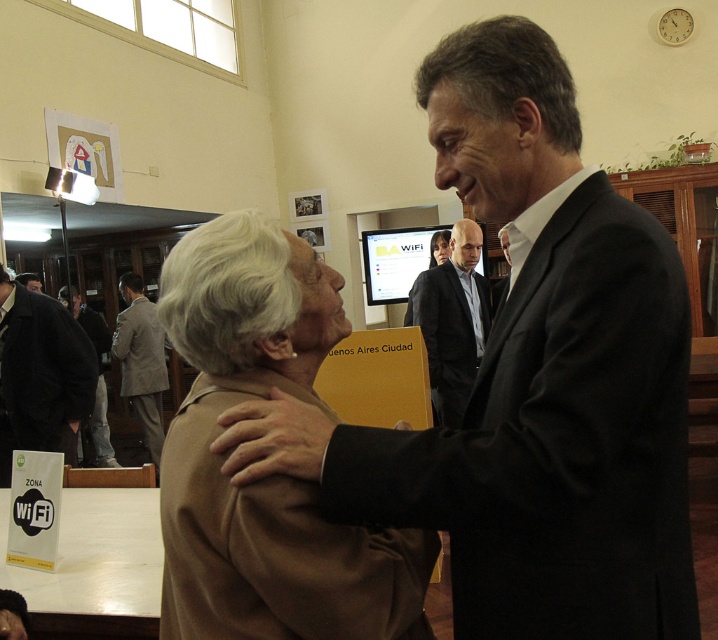
Between point (378, 579) and point (432, 365), which one is positioned behind?

Positioned behind is point (432, 365).

Is brown woolen coat at center closer to the viewer compared to dark suit jacket at center?

Yes.

Measure the distance between brown woolen coat at center and camera.

The distance of brown woolen coat at center from camera is 35.99 inches.

Where is `brown woolen coat at center`? brown woolen coat at center is located at coordinates (274, 476).

Is black leather jacket at left below dark suit jacket at center?

Indeed, black leather jacket at left is positioned under dark suit jacket at center.

Between black leather jacket at left and dark suit jacket at center, which one has more height?

dark suit jacket at center is taller.

Measure the distance between point (46, 396) and camera.

Point (46, 396) is 10.53 feet from camera.

Identify the location of black leather jacket at left. (42, 369).

Can you confirm if dark suit jacket at center is shorter than brown leather jacket at lower left?

Correct, dark suit jacket at center is not as tall as brown leather jacket at lower left.

Can you confirm if dark suit jacket at center is bigger than brown leather jacket at lower left?

No, dark suit jacket at center is not bigger than brown leather jacket at lower left.

Is point (447, 336) farther from viewer compared to point (90, 310)?

No, (447, 336) is closer to viewer.

I want to click on dark suit jacket at center, so click(452, 321).